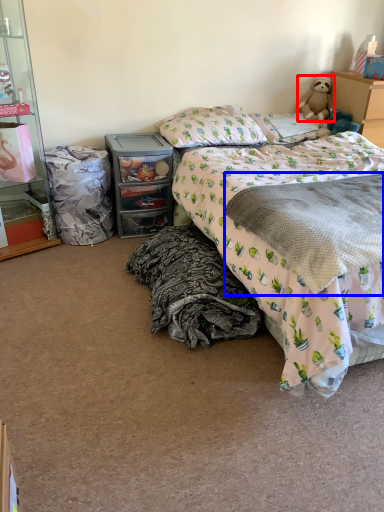
Question: Which object appears farthest to the camera in this image, teddy bear (highlighted by a red box) or blanket (highlighted by a blue box)?

Choices:
 (A) teddy bear
 (B) blanket

Answer: (A)